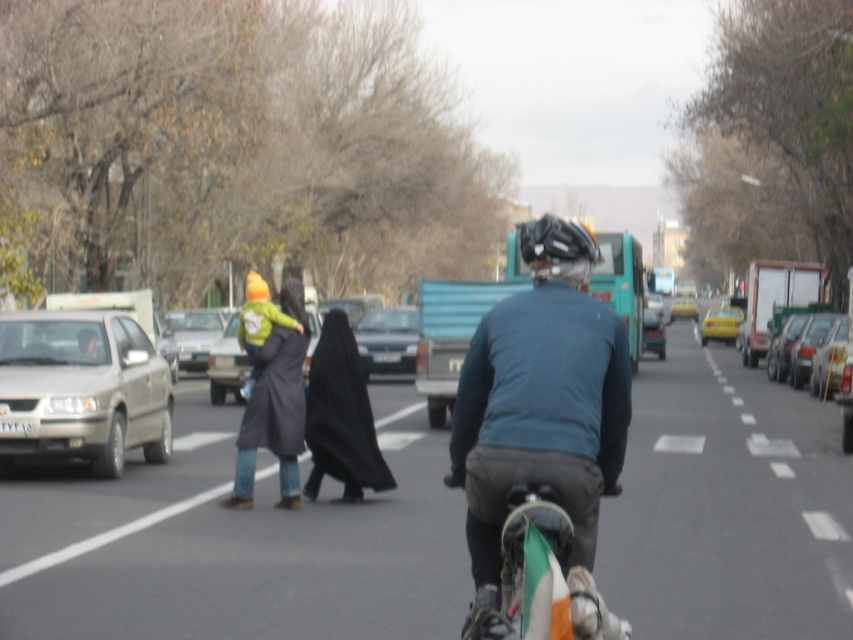
Question: From the image, what is the correct spatial relationship of silver metallic van at left in relation to yellow matte taxi at right?

Choices:
 (A) left
 (B) right

Answer: (A)

Question: Which point is farther to the camera?

Choices:
 (A) (296, 292)
 (B) (113, 365)
 (C) (230, 337)
 (D) (502, 588)

Answer: (C)

Question: Which object is the closest to the teal jersey at center?

Choices:
 (A) matte gray car at center
 (B) black fabric at center

Answer: (B)

Question: Among these points, which one is farthest from the camera?

Choices:
 (A) (347, 433)
 (B) (44, 401)
 (C) (473, 336)
 (D) (712, 321)

Answer: (D)

Question: Does matte gray car at center appear under yellow matte car at center?

Choices:
 (A) yes
 (B) no

Answer: (B)

Question: Is teal jersey at center wider than shiny metallic bicycle at center?

Choices:
 (A) no
 (B) yes

Answer: (A)